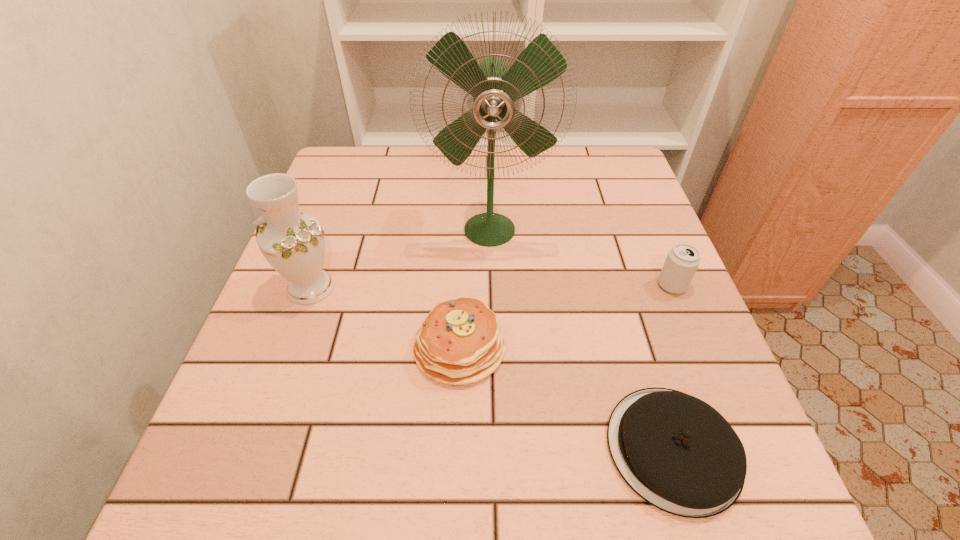
You are a GUI agent. You are given a task and a screenshot of the screen. Output one action in this format:
    pyautogui.click(x=<x>, y=<y>)
    Task: Click on the free region located 0.250m on the front of the vase
    This screenshot has height=540, width=960.
    Given the screenshot: What is the action you would take?
    pyautogui.click(x=258, y=432)

The width and height of the screenshot is (960, 540). In order to click on vacant space positioned on the back of the can in this screenshot , I will do `click(661, 259)`.

Locate an element on the screen. The image size is (960, 540). free space located on the back of the farther pancake is located at coordinates (463, 273).

The image size is (960, 540). Identify the location of blank space located on the back of the shorter pancake. (615, 263).

Find the location of a particular element. object located at the near edge is located at coordinates (678, 453).

In order to click on object that is at the left edge in this screenshot , I will do [293, 243].

The image size is (960, 540). In order to click on can at the right edge in this screenshot , I will do `click(682, 261)`.

Identify the location of pancake at the right edge. (678, 453).

You are a GUI agent. You are given a task and a screenshot of the screen. Output one action in this format:
    pyautogui.click(x=<x>, y=<y>)
    Task: Click on the object located in the near right corner section of the desktop
    This screenshot has height=540, width=960.
    Given the screenshot: What is the action you would take?
    [x=678, y=453]

The height and width of the screenshot is (540, 960). In order to click on vacant space at the far edge of the desktop in this screenshot , I will do `click(516, 186)`.